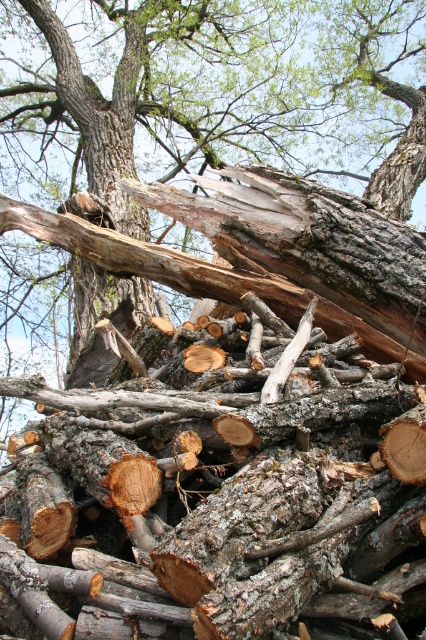
Question: Is gray bark tree trunk at center behind gray rough bark tree trunk at upper center?

Choices:
 (A) yes
 (B) no

Answer: (B)

Question: Where is gray bark tree trunk at center located in relation to gray rough bark tree trunk at upper center in the image?

Choices:
 (A) right
 (B) left

Answer: (A)

Question: Among these points, which one is farthest from the camera?

Choices:
 (A) (104, 301)
 (B) (80, 339)

Answer: (B)

Question: Observing the image, what is the correct spatial positioning of gray bark tree trunk at center in reference to gray rough bark tree trunk at upper center?

Choices:
 (A) above
 (B) below

Answer: (A)

Question: Which of the following is the farthest from the observer?

Choices:
 (A) (296, 36)
 (B) (106, 301)

Answer: (A)

Question: Which of the following is the closest to the observer?

Choices:
 (A) gray bark tree trunk at center
 (B) gray rough bark tree trunk at upper center

Answer: (A)